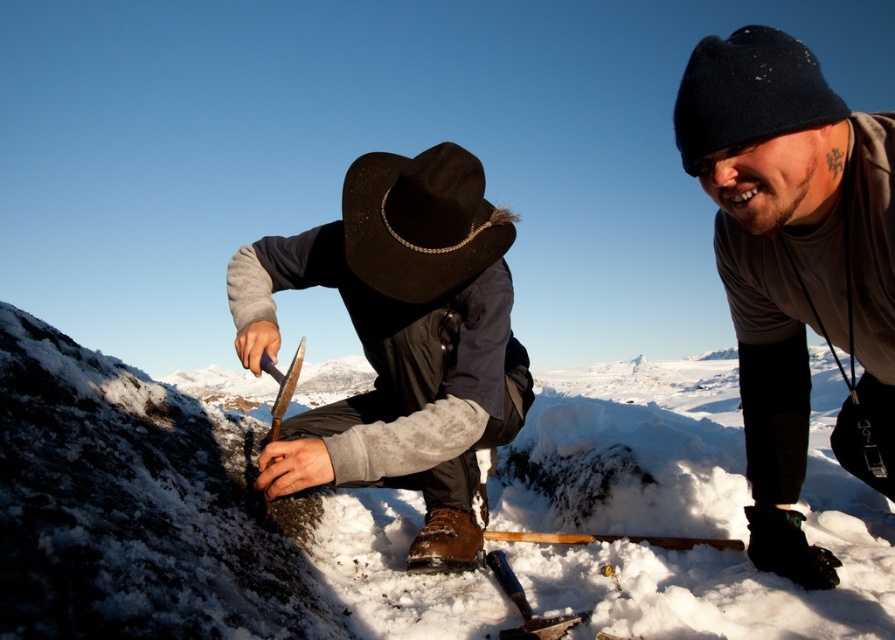
You are a photographer trying to capture both the dark gray knit hat at upper right and the black felt cowboy hat at upper center in a single frame. Which hat will appear wider in the photo?

The dark gray knit hat at upper right will appear wider in the photo since its width surpasses that of the black felt cowboy hat at upper center.

You are planning to build a snowman in this snowy landscape. Where exactly is the white fluffy snow at center located in the image?

The white fluffy snow at center is located at point (186, 518) in the image.

You are planning to build a snowman using the white fluffy snow at center and the black felt cowboy hat at upper center as a decoration. Since the snowman requires the snow to be wider than the hat, will the snow at center be suitable for this purpose?

The white fluffy snow at center has a width that surpasses the black felt cowboy hat at upper center, making it suitable for building a snowman where the snow needs to be wider than the hat.